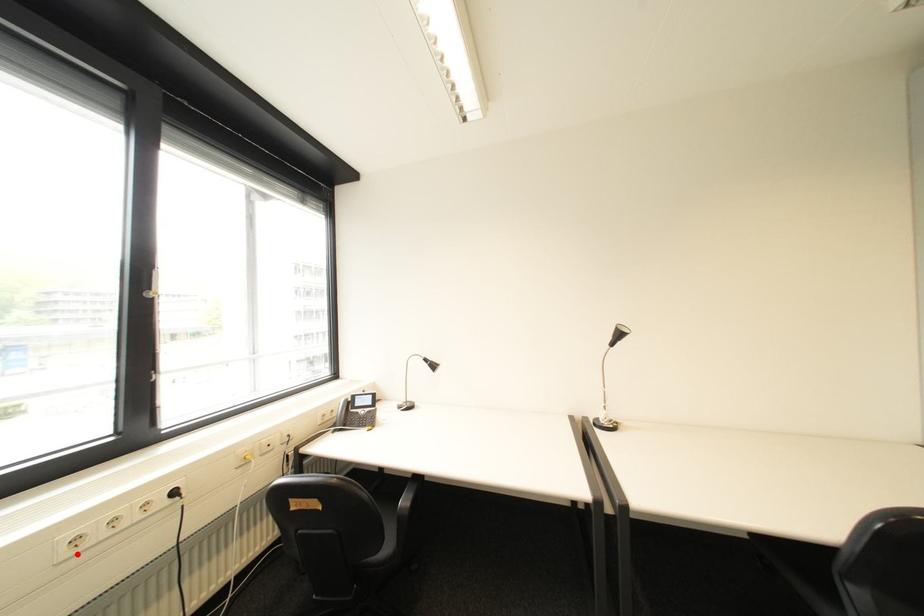
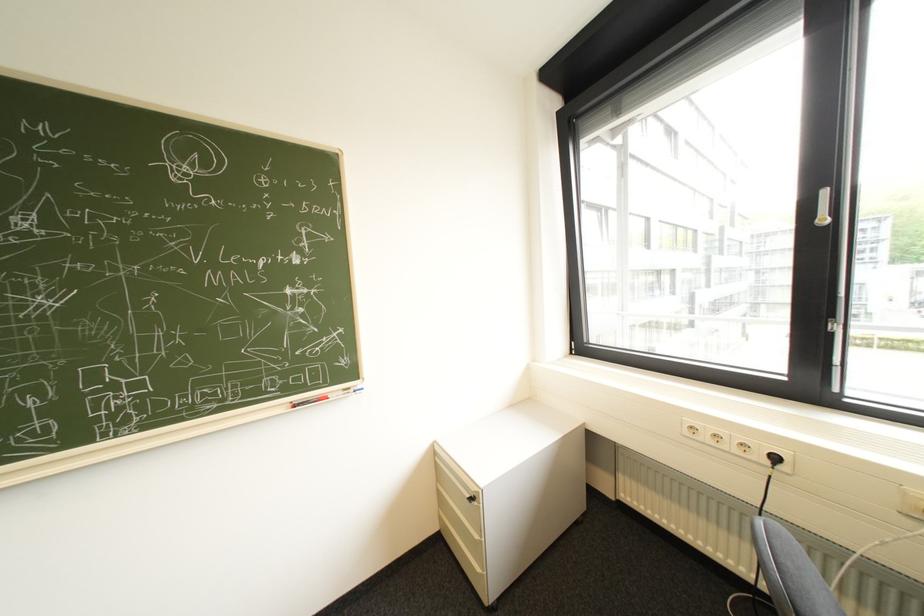
Locate, in the second image, the point that corresponds to the highlighted location in the first image.

(698, 434)